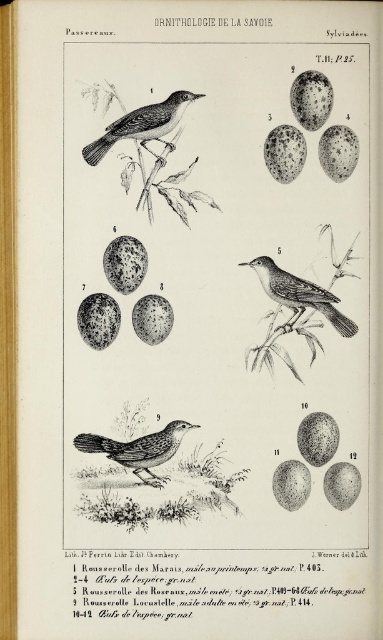
Question: Which point is farther to the camera?

Choices:
 (A) (243, 264)
 (B) (158, 122)

Answer: (A)

Question: Can you confirm if smooth brown bird at upper center is thinner than smooth brown bird at center?

Choices:
 (A) no
 (B) yes

Answer: (A)

Question: Is brown textured bird at center to the right of smooth brown bird at upper center from the viewer's perspective?

Choices:
 (A) no
 (B) yes

Answer: (A)

Question: Does brown textured bird at center have a greater width compared to smooth brown bird at center?

Choices:
 (A) yes
 (B) no

Answer: (A)

Question: Which object is positioned farthest from the brown textured bird at center?

Choices:
 (A) smooth brown bird at upper center
 (B) smooth brown bird at center

Answer: (A)

Question: Which of the following is the closest to the observer?

Choices:
 (A) smooth brown bird at center
 (B) smooth brown bird at upper center
 (C) brown textured bird at center

Answer: (B)